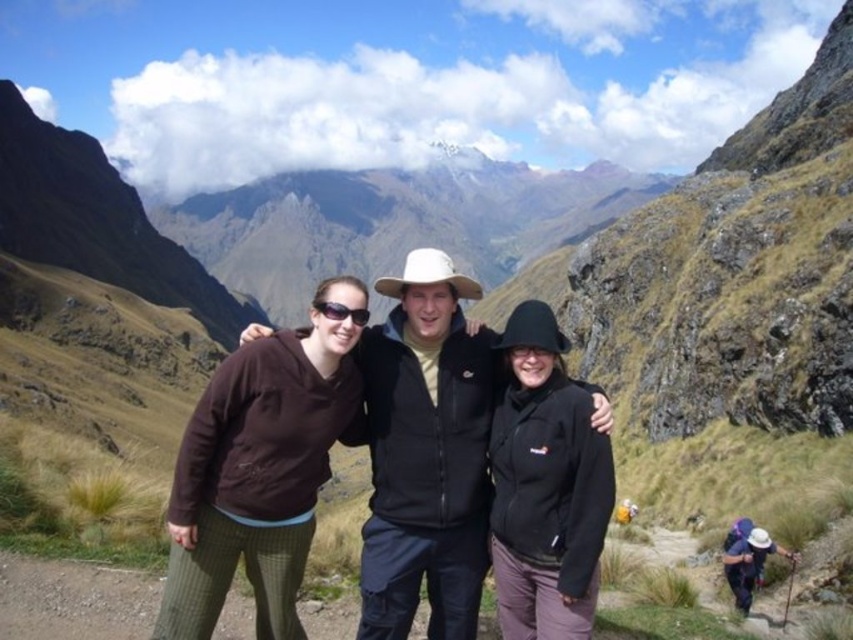
Question: Can you confirm if brown fleece at center is bigger than black fleece jacket at center?

Choices:
 (A) no
 (B) yes

Answer: (B)

Question: Which object is closer to the camera taking this photo?

Choices:
 (A) black fleece jacket at center
 (B) brown fleece at center
 (C) black matte jacket at center

Answer: (B)

Question: Which point is closer to the camera?

Choices:
 (A) black fleece jacket at center
 (B) black matte jacket at center

Answer: (A)

Question: Is black matte jacket at center below black fleece jacket at center?

Choices:
 (A) yes
 (B) no

Answer: (B)

Question: Which of the following is the closest to the observer?

Choices:
 (A) brown fleece at center
 (B) black fleece jacket at center

Answer: (A)

Question: Does brown fleece at center have a greater width compared to black matte jacket at center?

Choices:
 (A) no
 (B) yes

Answer: (A)